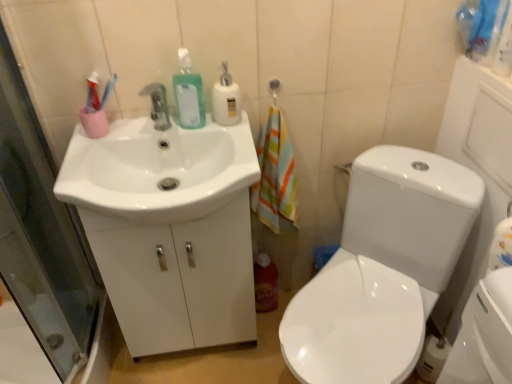
You are a GUI agent. You are given a task and a screenshot of the screen. Output one action in this format:
    pyautogui.click(x=<x>, y=<y>)
    Task: Click on the vacant area in front of white glossy soap dispenser at upper center, positioned as the 2th cleaning product in front-to-back order
    
    Given the screenshot: What is the action you would take?
    pyautogui.click(x=234, y=147)